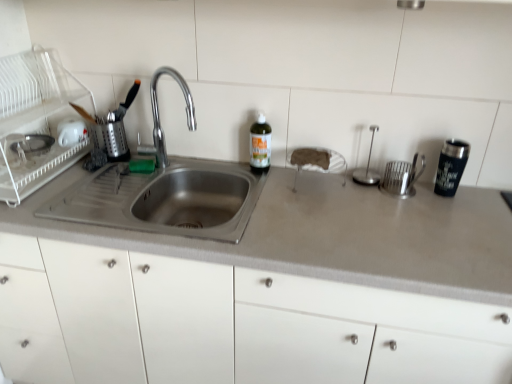
What are the coordinates of `free point in front of white matte sponge at center, which appears as the 3th appliance when viewed from the right` in the screenshot? It's located at (322, 206).